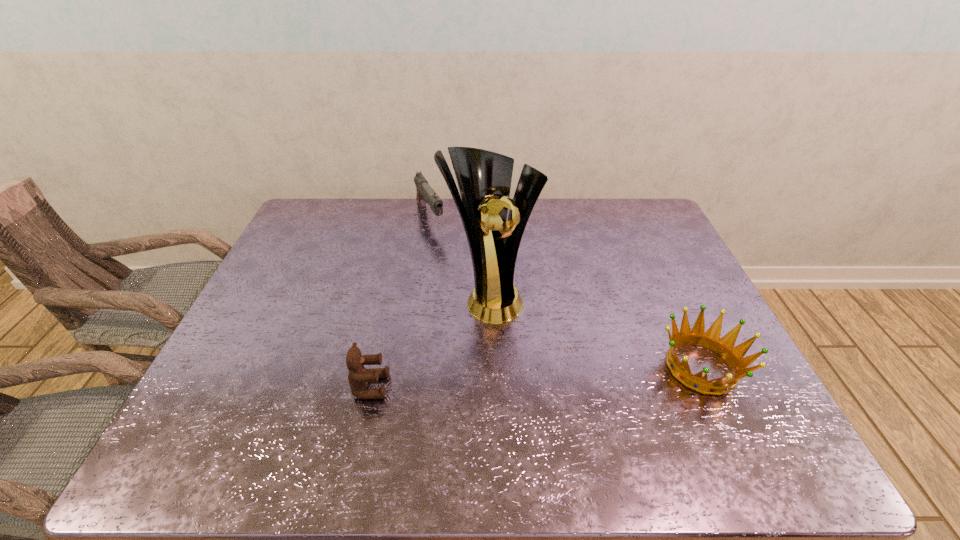
The width and height of the screenshot is (960, 540). I want to click on teddy bear, so click(358, 376).

Locate an element on the screen. Image resolution: width=960 pixels, height=540 pixels. the shortest object is located at coordinates (711, 339).

Where is `crown`? This screenshot has height=540, width=960. crown is located at coordinates (711, 339).

Find the location of `the farthest object`. the farthest object is located at coordinates (425, 194).

Identify the location of the second farthest object. The image size is (960, 540). (484, 177).

Locate an element on the screen. The width and height of the screenshot is (960, 540). the tallest object is located at coordinates (484, 177).

Locate an element on the screen. free location located 0.070m on the face of the teddy bear is located at coordinates (418, 386).

Locate an element on the screen. The image size is (960, 540). free spot located 0.050m on the left of the rightmost object is located at coordinates (636, 367).

This screenshot has height=540, width=960. I want to click on blank space located 0.060m in the direction the farthest object is aimed, so click(x=441, y=245).

You are a GUI agent. You are given a task and a screenshot of the screen. Output one action in this format:
    pyautogui.click(x=<x>, y=<y>)
    Task: Click on the free space located in the direction the farthest object is aimed
    The width and height of the screenshot is (960, 540).
    Given the screenshot: What is the action you would take?
    pyautogui.click(x=476, y=299)